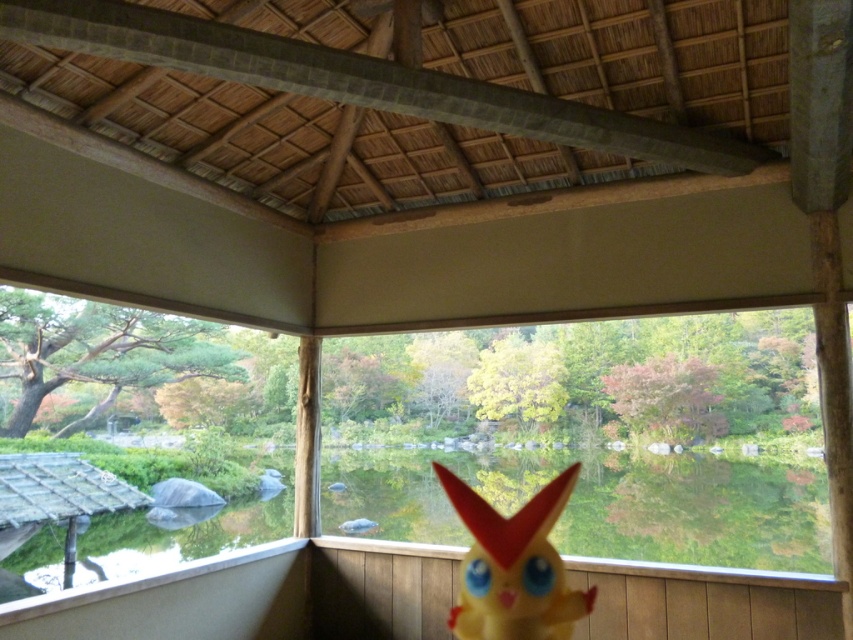
Question: Is transparent glass window at center positioned at the back of transparent glass window at left?

Choices:
 (A) yes
 (B) no

Answer: (B)

Question: Can you confirm if transparent glass window at left is positioned to the right of yellow rubber toy at center?

Choices:
 (A) yes
 (B) no

Answer: (B)

Question: Which point is closer to the camera taking this photo?

Choices:
 (A) (474, 545)
 (B) (41, 378)

Answer: (A)

Question: Where is transparent glass window at center located in relation to yellow rubber toy at center in the image?

Choices:
 (A) below
 (B) above

Answer: (A)

Question: Based on their relative distances, which object is nearer to the yellow rubber toy at center?

Choices:
 (A) transparent glass window at center
 (B) transparent glass window at left

Answer: (B)

Question: Estimate the real-world distances between objects in this image. Which object is closer to the transparent glass window at left?

Choices:
 (A) transparent glass window at center
 (B) yellow rubber toy at center

Answer: (A)